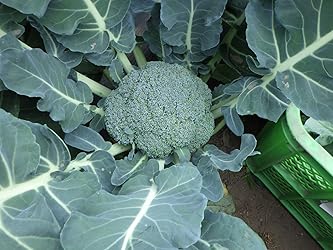
You are a GUI agent. You are given a task and a screenshot of the screen. Output one action in this format:
    pyautogui.click(x=<x>, y=<y>)
    Task: Click on the green basket
    This screenshot has width=333, height=250.
    Given the screenshot: What is the action you would take?
    pyautogui.click(x=291, y=145)